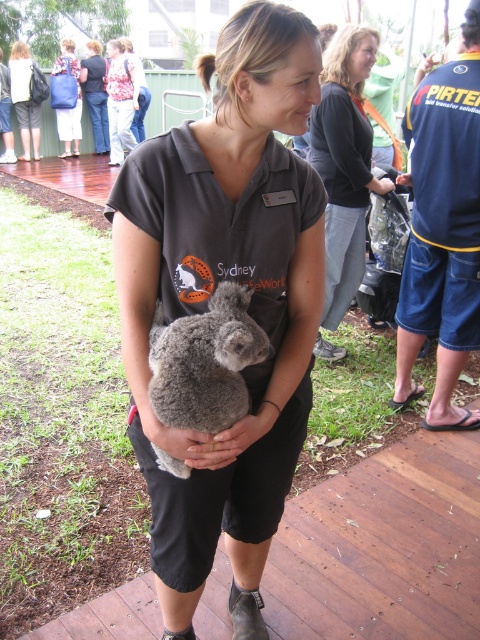
Question: Is dark gray fleece shirt at center above matte black shirt at center?

Choices:
 (A) yes
 (B) no

Answer: (B)

Question: Is dark gray fleece shirt at center to the right of dark gray sweater at upper center from the viewer's perspective?

Choices:
 (A) no
 (B) yes

Answer: (A)

Question: Which point is farther to the camera?

Choices:
 (A) (330, 298)
 (B) (166, 390)

Answer: (A)

Question: Among these objects, which one is farthest from the camera?

Choices:
 (A) dark gray fleece shirt at center
 (B) fuzzy gray koala at center

Answer: (A)

Question: Which object is closer to the camera taking this photo?

Choices:
 (A) fuzzy gray koala at center
 (B) dark gray sweater at upper center

Answer: (A)

Question: Is dark gray fleece shirt at center closer to the viewer compared to fuzzy gray koala at center?

Choices:
 (A) yes
 (B) no

Answer: (B)